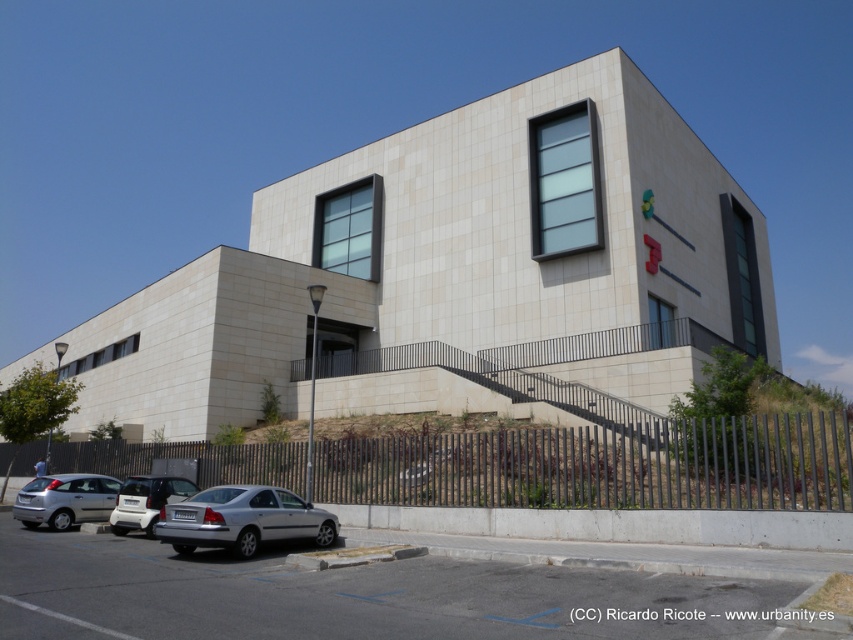
Consider the image. You are standing in front of the modern building and want to take a photo of the logo. You notice two points marked on the building wall. Which point is closer to you, point (605, 580) or point (444, 474)?

Point (605, 580) is closer to the viewer than point (444, 474).

You are a visitor approaching the building and need to park your car. You see the gray asphalt parking lot at lower center and the metallic gray fence at lower center. Which one should you go above or below to reach the parking area?

The gray asphalt parking lot at lower center is above the metallic gray fence at lower center, so to reach the parking area you should go below the metallic gray fence at lower center.